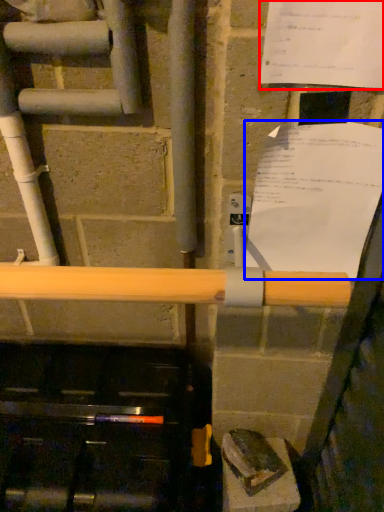
Question: Which point is further to the camera, paper (highlighted by a red box) or paper (highlighted by a blue box)?

Choices:
 (A) paper
 (B) paper

Answer: (B)